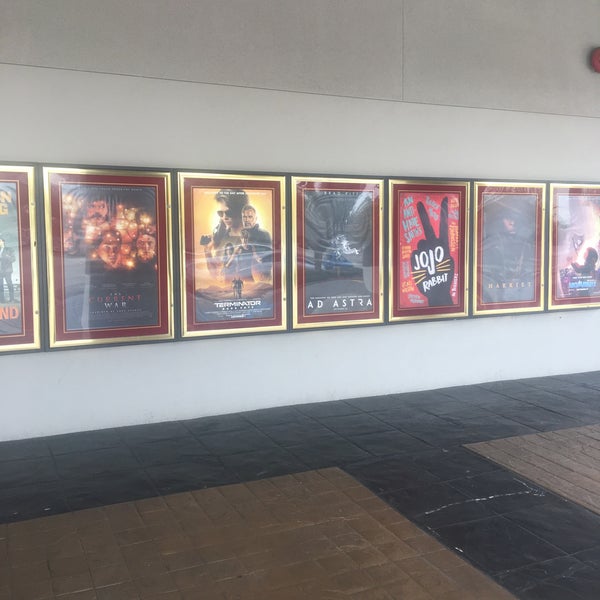
You are a GUI agent. You are given a task and a screenshot of the screen. Output one action in this format:
    pyautogui.click(x=<x>, y=<y>)
    Task: Click on the poster
    Image resolution: width=600 pixels, height=600 pixels.
    Given the screenshot: What is the action you would take?
    pyautogui.click(x=459, y=302)